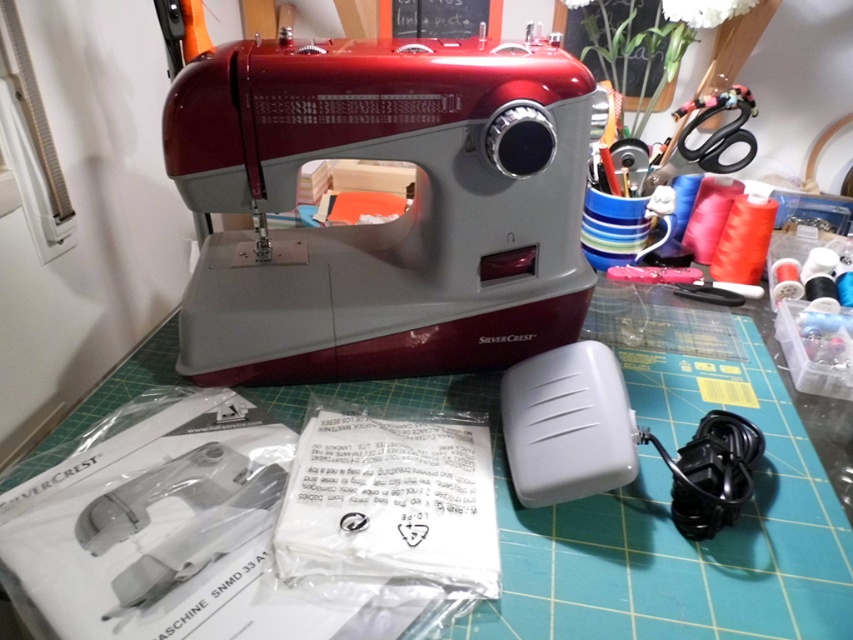
Between matte red sewing machine at center and metallic silver scissors at upper right, which one has less height?

metallic silver scissors at upper right is shorter.

Does point (567, 285) lie behind point (671, 173)?

No, it is not.

You are a GUI agent. You are given a task and a screenshot of the screen. Output one action in this format:
    pyautogui.click(x=<x>, y=<y>)
    Task: Click on the matte red sewing machine at center
    
    Given the screenshot: What is the action you would take?
    pyautogui.click(x=384, y=224)

The image size is (853, 640). I want to click on matte red sewing machine at center, so click(384, 224).